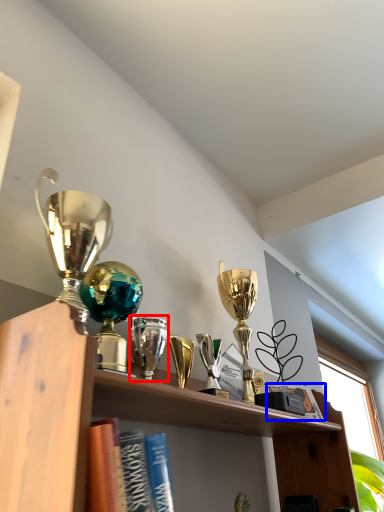
Question: Which point is closer to the camera, trophy (highlighted by a red box) or book (highlighted by a blue box)?

Choices:
 (A) trophy
 (B) book

Answer: (A)